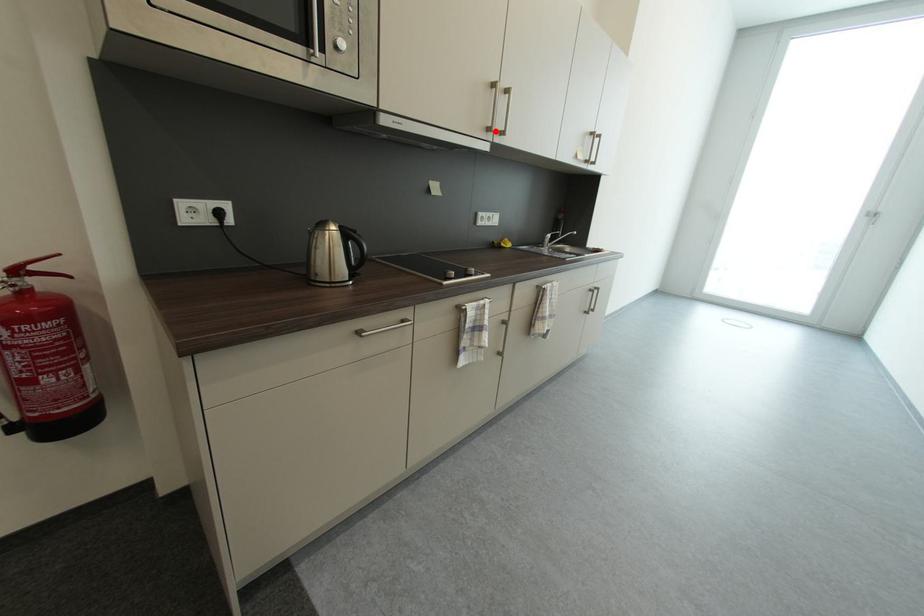
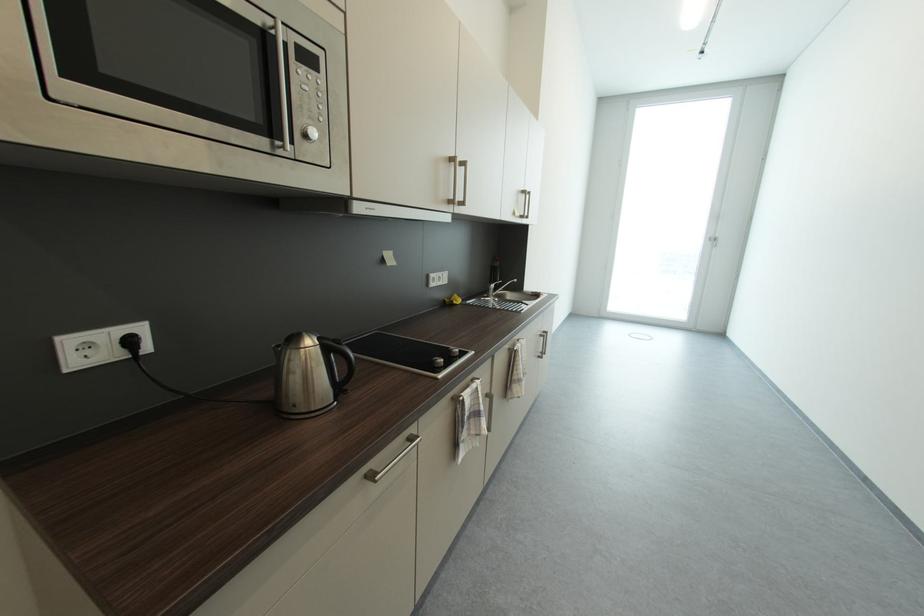
The point at the highlighted location is marked in the first image. Where is the corresponding point in the second image?

(457, 204)